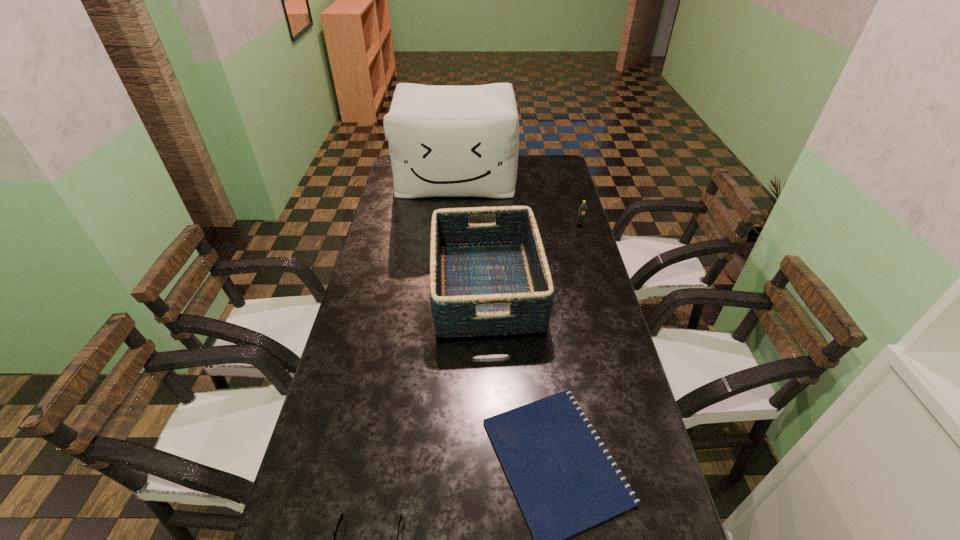
The height and width of the screenshot is (540, 960). What are the coordinates of `the tallest object` in the screenshot? It's located at (444, 141).

Image resolution: width=960 pixels, height=540 pixels. I want to click on cushion, so click(444, 141).

This screenshot has width=960, height=540. Identify the location of the second tallest object. (486, 279).

Find the location of `the third nearest object`. the third nearest object is located at coordinates (486, 279).

Where is `the rightmost object`? The image size is (960, 540). the rightmost object is located at coordinates (583, 207).

Where is `soda`? soda is located at coordinates (583, 207).

Image resolution: width=960 pixels, height=540 pixels. I want to click on free region located 0.170m on the side of the farthest object with the smiley face, so click(452, 225).

Identify the location of blank space located on the front of the basket. (489, 441).

Locate an element on the screen. This screenshot has width=960, height=540. blank space located 0.350m on the front label of the fourth nearest object is located at coordinates (599, 290).

This screenshot has width=960, height=540. Find the location of `object at the far edge`. object at the far edge is located at coordinates (444, 141).